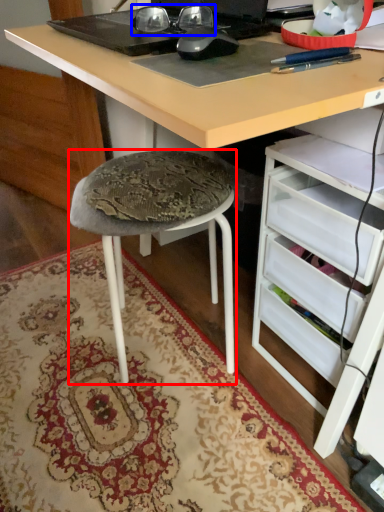
Question: Which object is further to the camera taking this photo, stool (highlighted by a red box) or glasses (highlighted by a blue box)?

Choices:
 (A) stool
 (B) glasses

Answer: (A)